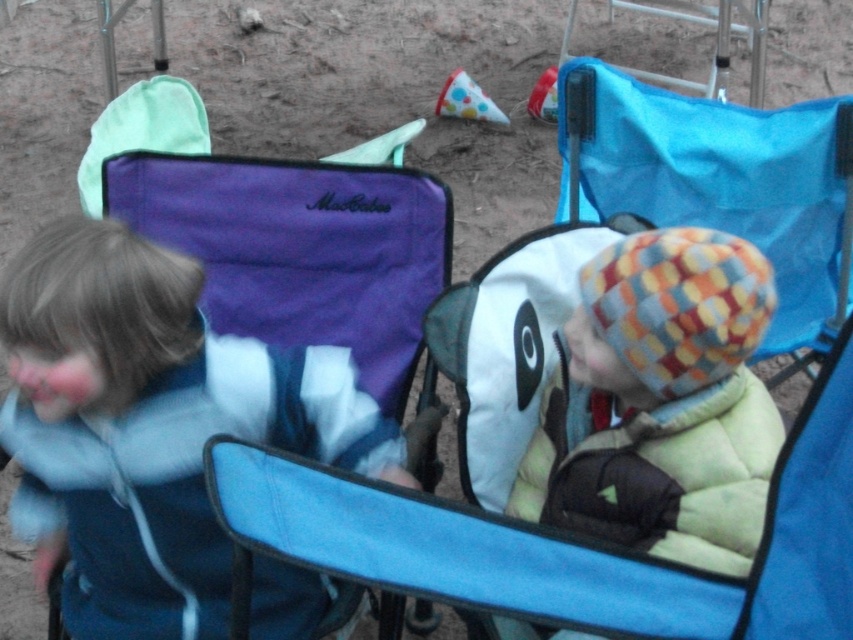
Does white fabric baby carriage at center appear under woolen checkered hat at center?

Correct, white fabric baby carriage at center is located below woolen checkered hat at center.

Does white fabric baby carriage at center have a lesser height compared to woolen checkered hat at center?

Incorrect, white fabric baby carriage at center's height does not fall short of woolen checkered hat at center's.

The height and width of the screenshot is (640, 853). Describe the element at coordinates (613, 477) in the screenshot. I see `white fabric baby carriage at center` at that location.

You are a GUI agent. You are given a task and a screenshot of the screen. Output one action in this format:
    pyautogui.click(x=<x>, y=<y>)
    Task: Click on the white fabric baby carriage at center
    The image size is (853, 640).
    Given the screenshot: What is the action you would take?
    pyautogui.click(x=613, y=477)

Does matte blue jacket at left have a lesser width compared to blue fabric folding chair at center?

No, matte blue jacket at left is not thinner than blue fabric folding chair at center.

Locate an element on the screen. matte blue jacket at left is located at coordinates (149, 426).

Is point (233, 348) closer to camera compared to point (640, 161)?

Yes, it is in front of point (640, 161).

What are the coordinates of `matte blue jacket at left` in the screenshot? It's located at (149, 426).

Can you confirm if matte blue jacket at left is positioned to the left of woolen checkered hat at center?

Indeed, matte blue jacket at left is positioned on the left side of woolen checkered hat at center.

Is point (86, 544) closer to viewer compared to point (589, 388)?

Yes, it is.

Identify the location of matte blue jacket at left. This screenshot has height=640, width=853. (149, 426).